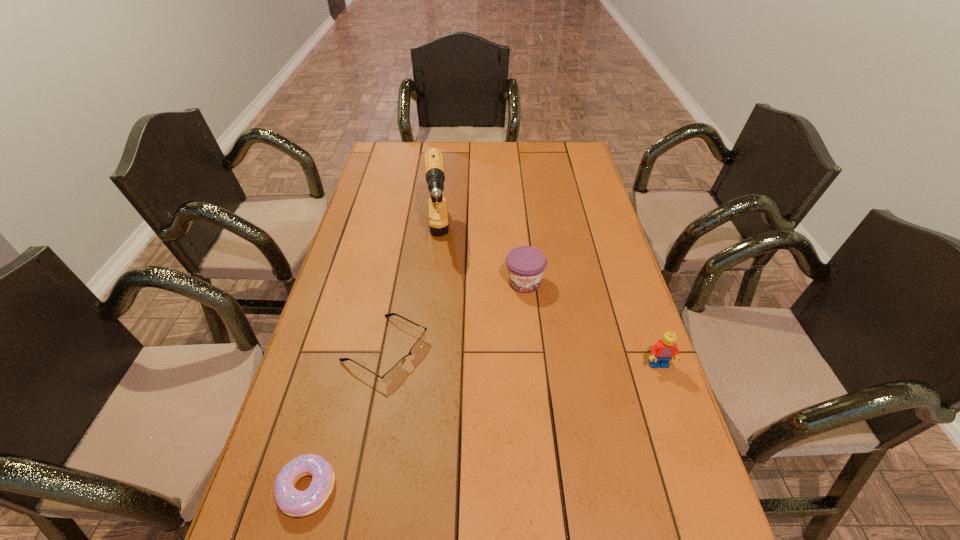
The image size is (960, 540). Identify the location of object that is the second nearest to the spectacles. (434, 169).

Where is `free space that satisfies the following two spatial constraints: 1. on the front side of the second object from right to left; 2. on the right side of the drill`? This screenshot has height=540, width=960. free space that satisfies the following two spatial constraints: 1. on the front side of the second object from right to left; 2. on the right side of the drill is located at coordinates (432, 282).

Image resolution: width=960 pixels, height=540 pixels. Find the location of `free space in the image that satisfies the following two spatial constraints: 1. on the front side of the third tallest object; 2. on the left side of the tallest object`. free space in the image that satisfies the following two spatial constraints: 1. on the front side of the third tallest object; 2. on the left side of the tallest object is located at coordinates (432, 282).